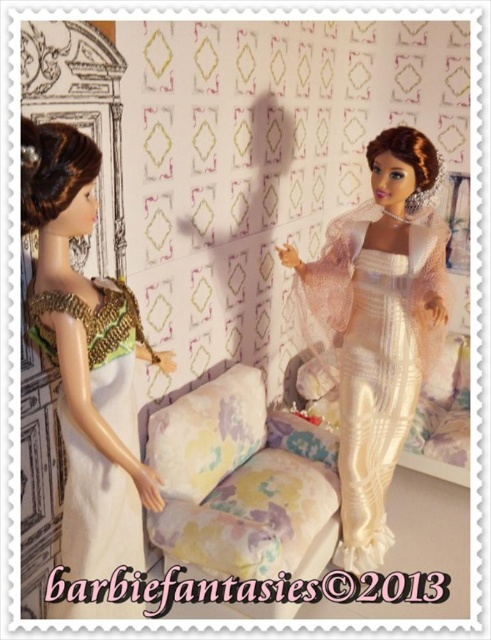
Can you confirm if ivory satin gown at center is taller than green and gold fabric dress at left?

Correct, ivory satin gown at center is much taller as green and gold fabric dress at left.

This screenshot has width=491, height=640. Describe the element at coordinates (380, 326) in the screenshot. I see `ivory satin gown at center` at that location.

The image size is (491, 640). I want to click on ivory satin gown at center, so click(380, 326).